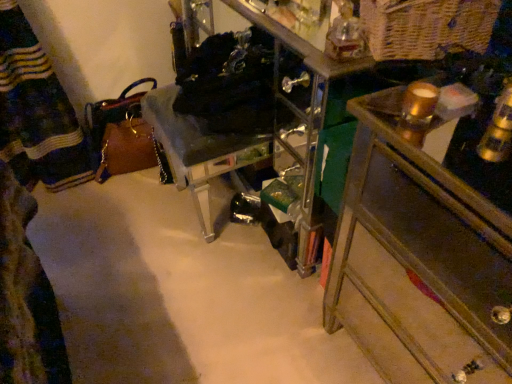
Locate an element on the screen. free space in front of gold metallic candle at upper right is located at coordinates (437, 148).